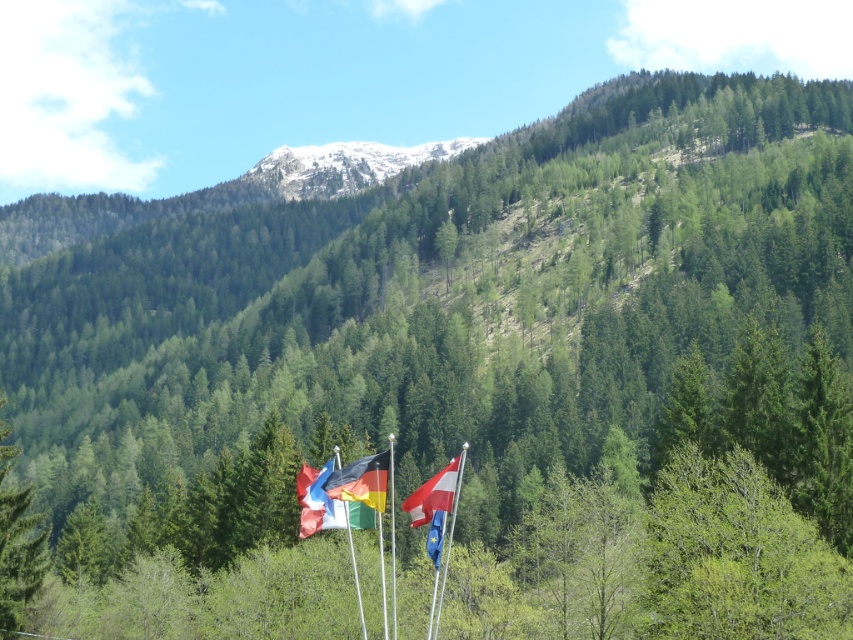
Question: Observing the image, what is the correct spatial positioning of matte black flag at center in reference to blue fabric flag at lower center?

Choices:
 (A) left
 (B) right

Answer: (A)

Question: Based on their relative distances, which object is farther from the matte black flag at center?

Choices:
 (A) white fabric flag at center
 (B) metallic silver flag pole at center

Answer: (A)

Question: Estimate the real-world distances between objects in this image. Which object is closer to the blue fabric flag at lower center?

Choices:
 (A) white fabric flag pole at center
 (B) white fabric flag at center
 (C) white snow-covered mountain at upper center

Answer: (A)

Question: In this image, where is polyester flag at center located relative to white fabric flag pole at center?

Choices:
 (A) right
 (B) left

Answer: (B)

Question: Can you confirm if matte black flag at center is smaller than blue fabric flag at lower center?

Choices:
 (A) yes
 (B) no

Answer: (B)

Question: Among these objects, which one is farthest from the camera?

Choices:
 (A) blue fabric flag at lower center
 (B) metallic silver flag pole at center

Answer: (A)